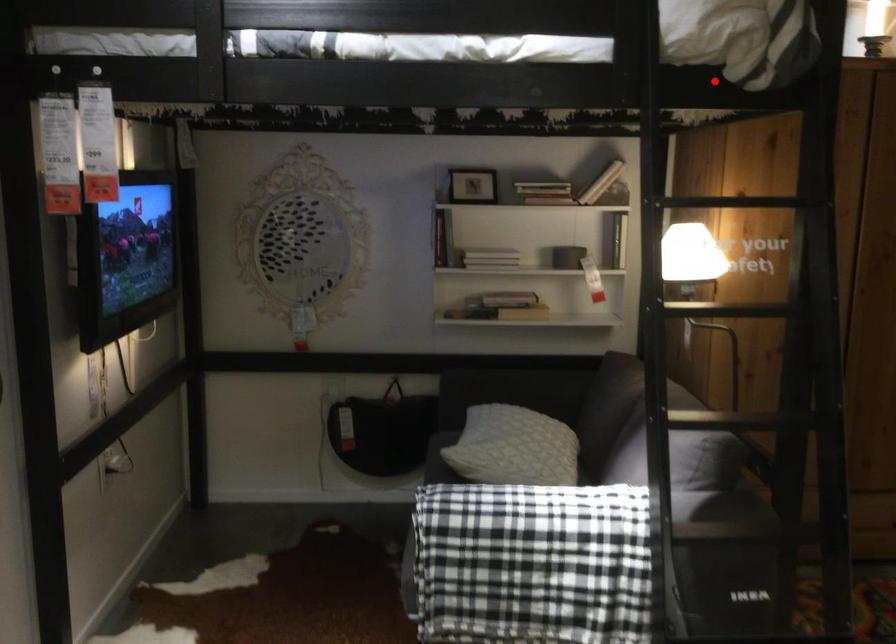
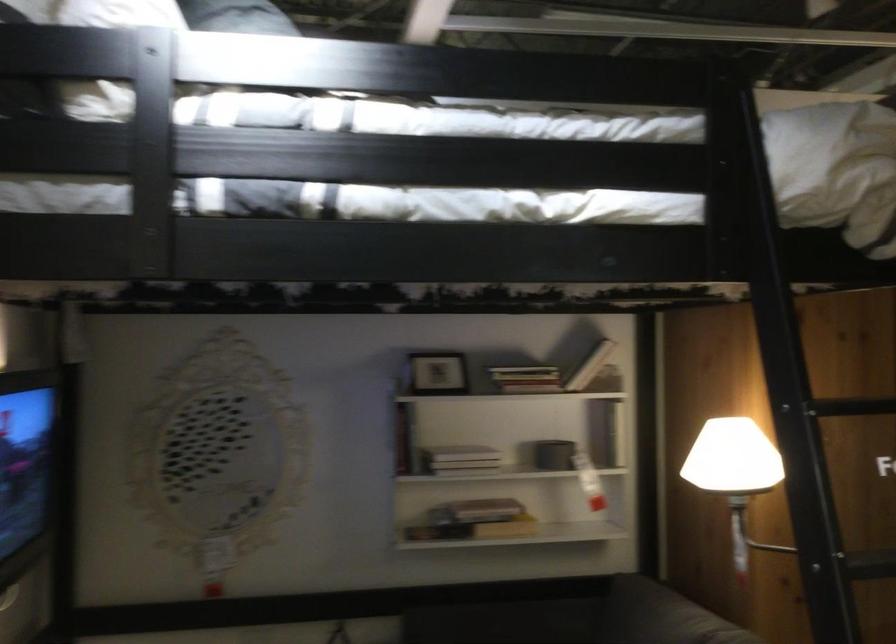
Question: I am providing you with two images of the same scene from different viewpoints. A red point is shown in image1. For the corresponding object point in image2, is it positioned nearer or farther from the camera?

Choices:
 (A) Nearer
 (B) Farther

Answer: (A)